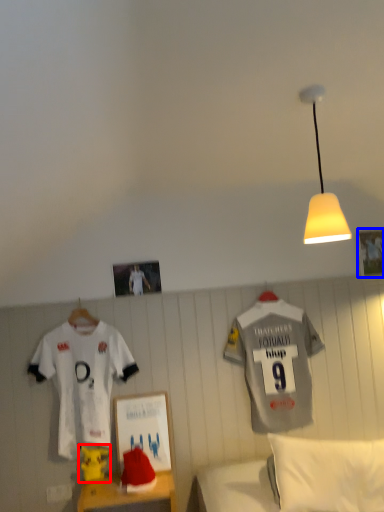
Question: Among these objects, which one is farthest to the camera, toy (highlighted by a red box) or picture frame (highlighted by a blue box)?

Choices:
 (A) toy
 (B) picture frame

Answer: (B)